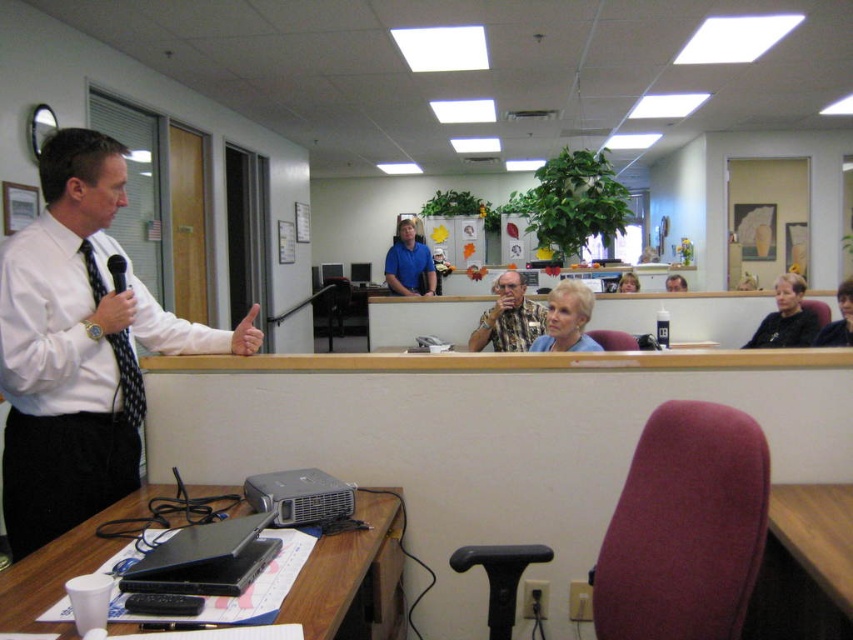
Question: Which object appears closest to the camera in this image?

Choices:
 (A) matte black hair at upper center
 (B) black plastic table at lower left
 (C) matte blue blouse at center
 (D) camouflage shirt at center

Answer: (B)

Question: Which point is farther to the camera?

Choices:
 (A) camouflage shirt at center
 (B) black plastic table at lower left
 (C) smooth brown hair at upper right
 (D) wooden table at lower right

Answer: (A)

Question: Which point is farther from the camera taking this photo?

Choices:
 (A) (802, 561)
 (B) (489, 611)
 (C) (227, 340)
 (D) (492, 346)

Answer: (D)

Question: Is white shirt at left above maroon fabric swivel chair at lower right?

Choices:
 (A) no
 (B) yes

Answer: (B)

Question: Does maroon fabric swivel chair at lower right appear on the left side of smooth skin face at upper center?

Choices:
 (A) no
 (B) yes

Answer: (B)

Question: Can you confirm if maroon fabric swivel chair at lower right is bigger than blue shirt at center?

Choices:
 (A) yes
 (B) no

Answer: (B)